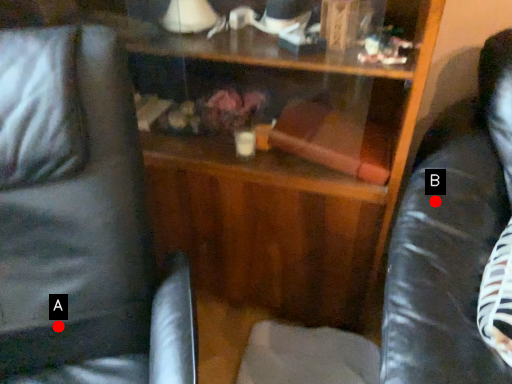
Question: Two points are circled on the image, labeled by A and B beside each circle. Which point is farther from the camera taking this photo?

Choices:
 (A) A is further
 (B) B is further

Answer: (B)